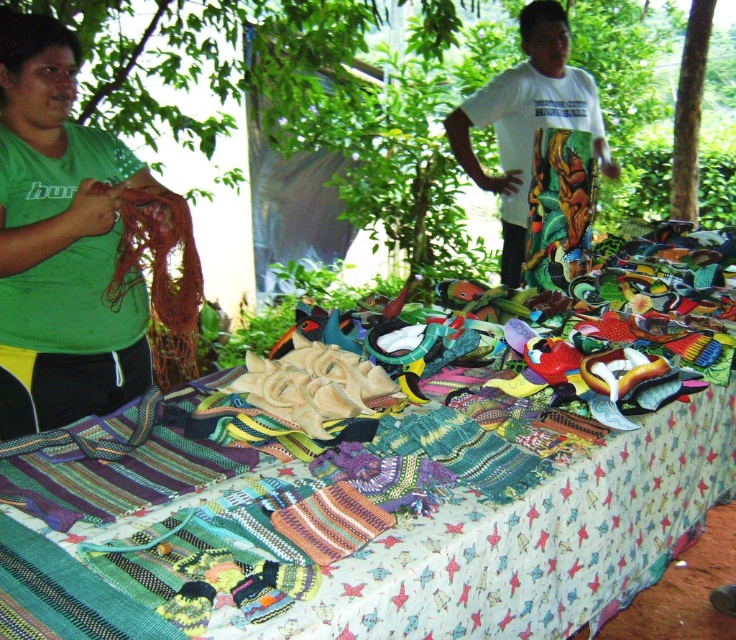
Question: Does textile bags at center have a smaller size compared to white printed t-shirt at upper right?

Choices:
 (A) yes
 (B) no

Answer: (B)

Question: From the image, what is the correct spatial relationship of textile bags at center in relation to white printed t-shirt at upper right?

Choices:
 (A) right
 (B) left

Answer: (B)

Question: Among these points, which one is farthest from the camera?

Choices:
 (A) (138, 284)
 (B) (718, 248)
 (C) (503, 278)

Answer: (C)

Question: Among these points, which one is nearest to the camera?

Choices:
 (A) pos(551,33)
 (B) pos(3,65)
 (C) pos(21,529)

Answer: (C)

Question: Which object appears farthest from the camera in this image?

Choices:
 (A) white printed t-shirt at upper right
 (B) green matte shirt at left

Answer: (A)

Question: Where is textile bags at center located in relation to white printed t-shirt at upper right in the image?

Choices:
 (A) left
 (B) right

Answer: (A)